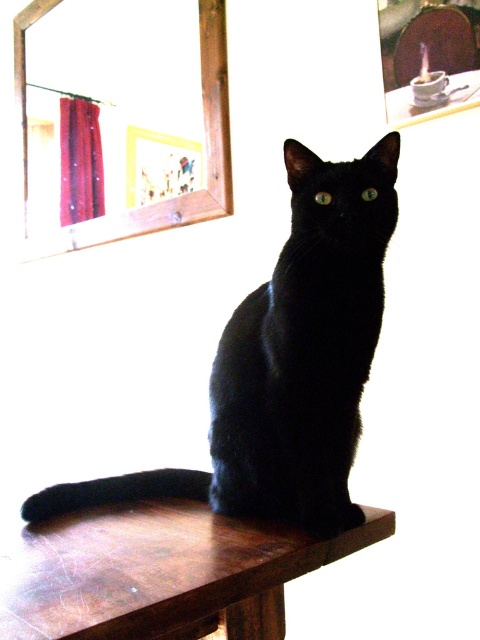
How distant is black glossy cat at center from wooden table at center?

The distance of black glossy cat at center from wooden table at center is 7.58 inches.

Is black glossy cat at center shorter than wooden table at center?

In fact, black glossy cat at center may be taller than wooden table at center.

Where is `black glossy cat at center`? The width and height of the screenshot is (480, 640). black glossy cat at center is located at coordinates tap(287, 364).